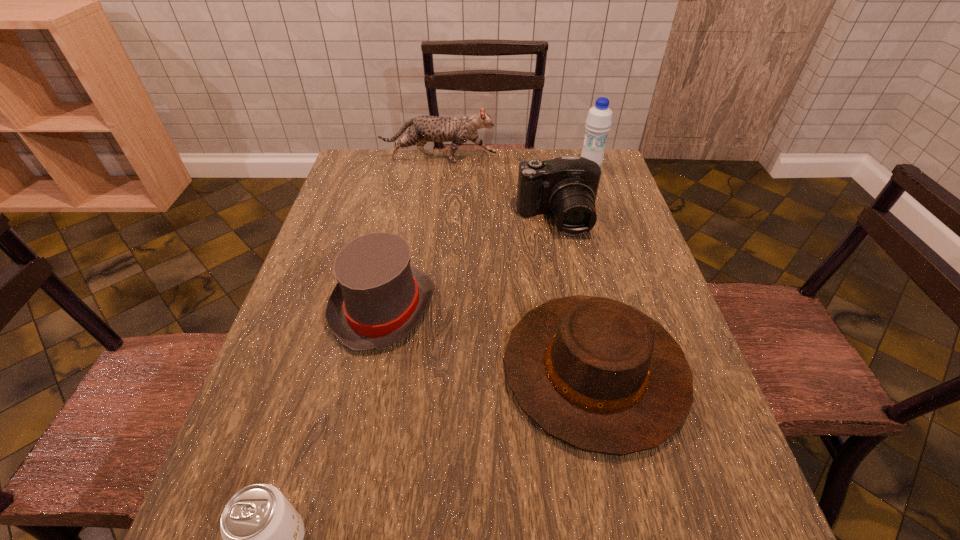
This screenshot has height=540, width=960. In the image, there is a desktop. What are the coordinates of `vacant region at the left edge` in the screenshot? It's located at (371, 191).

Find the location of a particular element. Image resolution: width=960 pixels, height=540 pixels. vacant space at the right edge of the desktop is located at coordinates (641, 274).

Identify the location of blank space at the far left corner. (380, 165).

Locate an element on the screen. free spot between the cowboy hat and the cat is located at coordinates (516, 265).

The width and height of the screenshot is (960, 540). What are the coordinates of `free space between the cowboy hat and the water bottle` in the screenshot? It's located at (592, 268).

Locate an element on the screen. Image resolution: width=960 pixels, height=540 pixels. free spot between the cowboy hat and the camera is located at coordinates (575, 295).

Where is `free space between the cowboy hat and the dress hat`? This screenshot has height=540, width=960. free space between the cowboy hat and the dress hat is located at coordinates (489, 339).

You are a GUI agent. You are given a task and a screenshot of the screen. Output one action in this format:
    pyautogui.click(x=<x>, y=<y>)
    Task: Click on the free space between the camera and the dress hat
    
    Given the screenshot: What is the action you would take?
    pyautogui.click(x=470, y=264)

Identify which object is located as the nearest to the water bottle. Please provide its 2D coordinates. Your answer should be formatted as a tuple, i.e. [(x, y)], where the tuple contains the x and y coordinates of a point satisfying the conditions above.

[(567, 186)]

I want to click on object that is the third nearest to the tallest object, so click(597, 374).